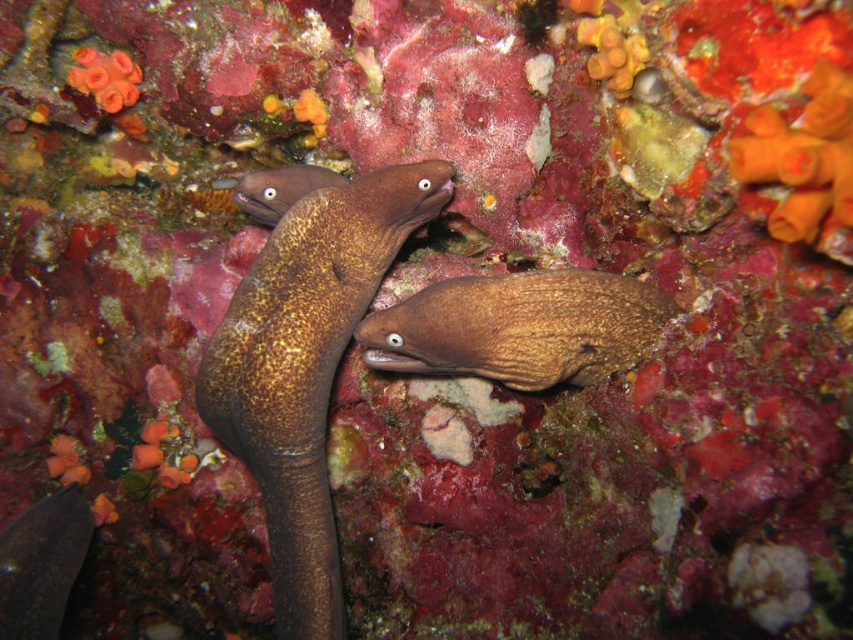
Can you confirm if shiny brown eel at center is taller than brown textured eel at center?

Yes.

Is point (206, 387) closer to viewer compared to point (384, 323)?

No.

The image size is (853, 640). I want to click on shiny brown eel at center, so click(306, 368).